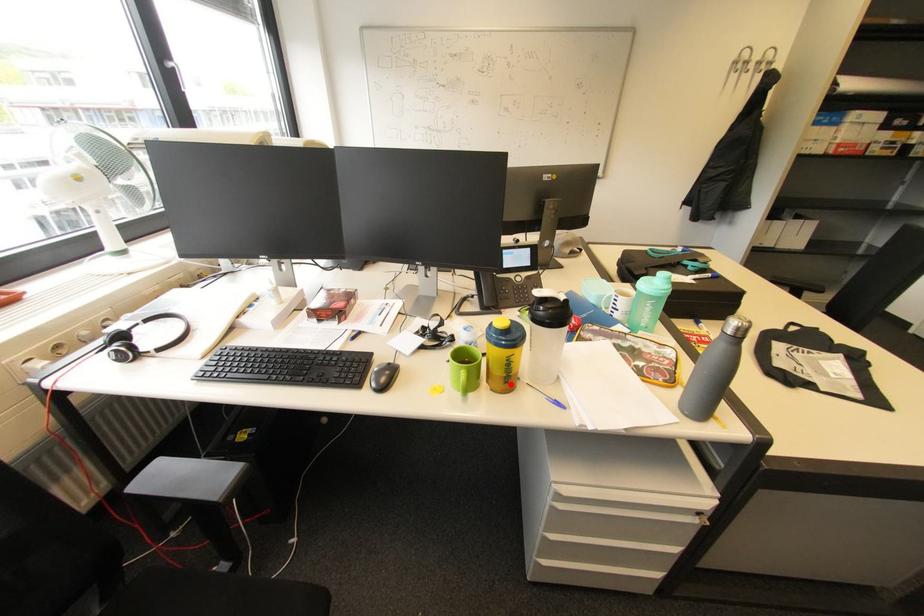
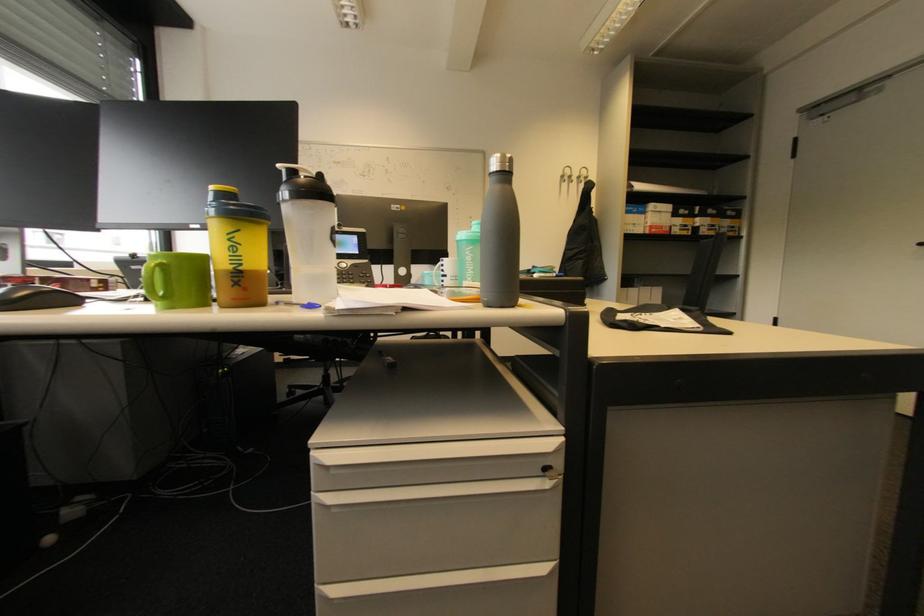
The point at the highlighted location is marked in the first image. Where is the corresponding point in the second image?

(239, 286)